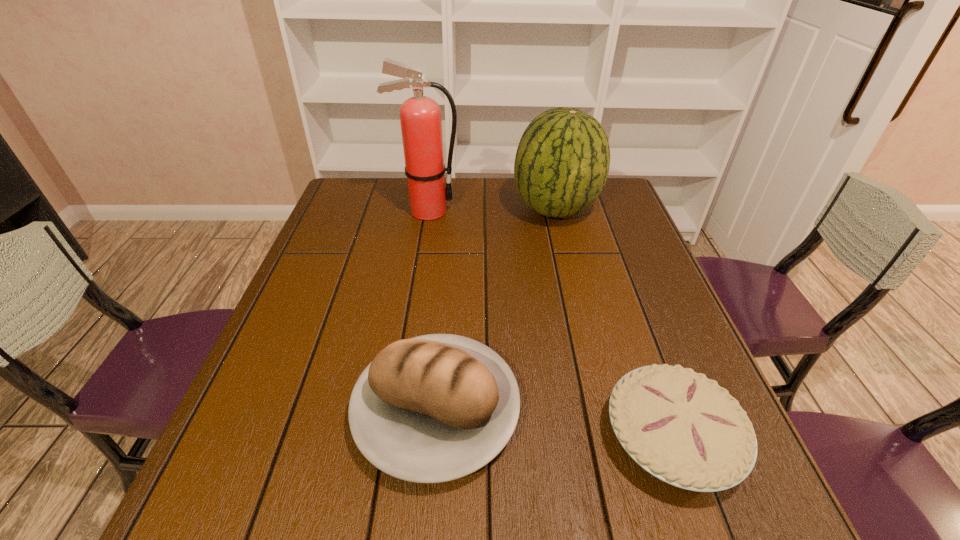
This screenshot has width=960, height=540. In order to click on bread positioned at the near edge in this screenshot , I will do `click(433, 408)`.

This screenshot has height=540, width=960. I want to click on pie located in the near edge section of the desktop, so click(x=684, y=429).

Where is `watermelon at the right edge`? The height and width of the screenshot is (540, 960). watermelon at the right edge is located at coordinates (562, 161).

At what (x,y) coordinates should I click in order to perform the action: click on pie present at the right edge. Please return your answer as a coordinate pair (x, y). Looking at the image, I should click on (684, 429).

Locate an element on the screen. This screenshot has height=540, width=960. object that is positioned at the far right corner is located at coordinates (562, 161).

Locate an element on the screen. object at the near right corner is located at coordinates (684, 429).

Find the location of a particular element. The height and width of the screenshot is (540, 960). vacant space at the far edge of the desktop is located at coordinates (401, 198).

This screenshot has width=960, height=540. Find the location of `free space at the near edge of the desktop`. free space at the near edge of the desktop is located at coordinates (510, 524).

In the image, there is a desktop. Where is `vacant space at the left edge`? vacant space at the left edge is located at coordinates (303, 357).

At what (x,y) coordinates should I click in order to perform the action: click on vacant space at the right edge of the desktop. Please return your answer as a coordinate pair (x, y). Looking at the image, I should click on (611, 274).